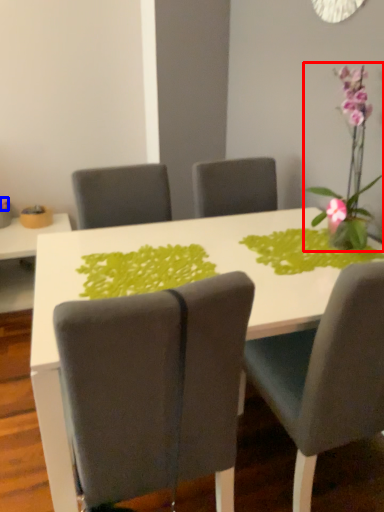
Question: Among these objects, which one is nearest to the camera, houseplant (highlighted by a red box) or flower (highlighted by a blue box)?

Choices:
 (A) houseplant
 (B) flower

Answer: (A)